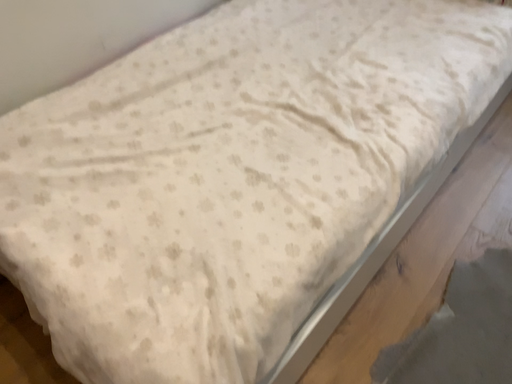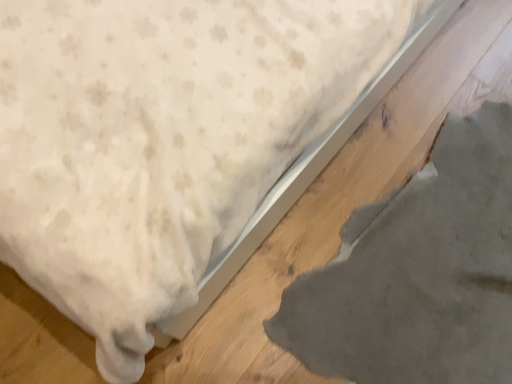
Question: Which way did the camera rotate in the video?

Choices:
 (A) rotated downward
 (B) rotated upward

Answer: (A)